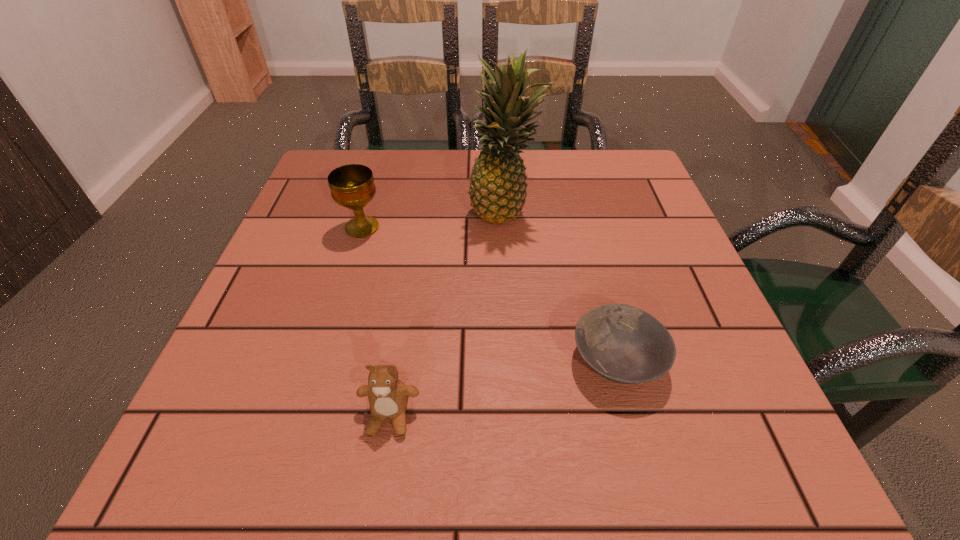
This screenshot has width=960, height=540. I want to click on the tallest object, so click(x=498, y=185).

At what (x,y) coordinates should I click in order to perform the action: click on pineapple. Please return your answer as a coordinate pair (x, y). The image size is (960, 540). Looking at the image, I should click on (498, 185).

Where is `chalice`? Image resolution: width=960 pixels, height=540 pixels. chalice is located at coordinates (352, 186).

Where is `the leftmost object`? The width and height of the screenshot is (960, 540). the leftmost object is located at coordinates (352, 186).

This screenshot has height=540, width=960. What are the coordinates of `teddy bear` in the screenshot? It's located at (388, 396).

I want to click on the second shortest object, so click(x=388, y=396).

Identify the location of the shortest object. (622, 343).

Where is `bowl`? bowl is located at coordinates (622, 343).

Where is `free location located on the right of the pineapple`? Image resolution: width=960 pixels, height=540 pixels. free location located on the right of the pineapple is located at coordinates (572, 211).

I want to click on vacant area situated 0.340m on the front of the chalice, so [314, 387].